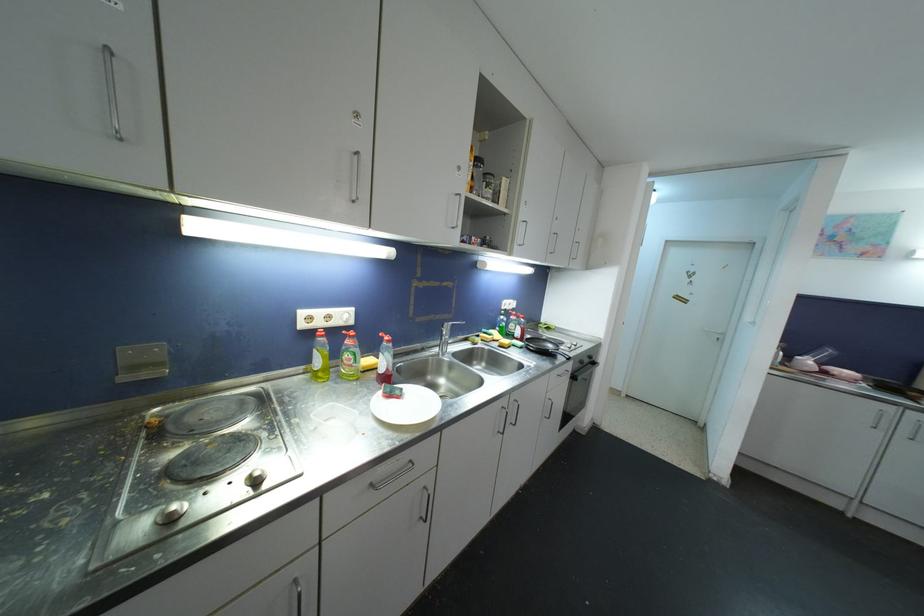
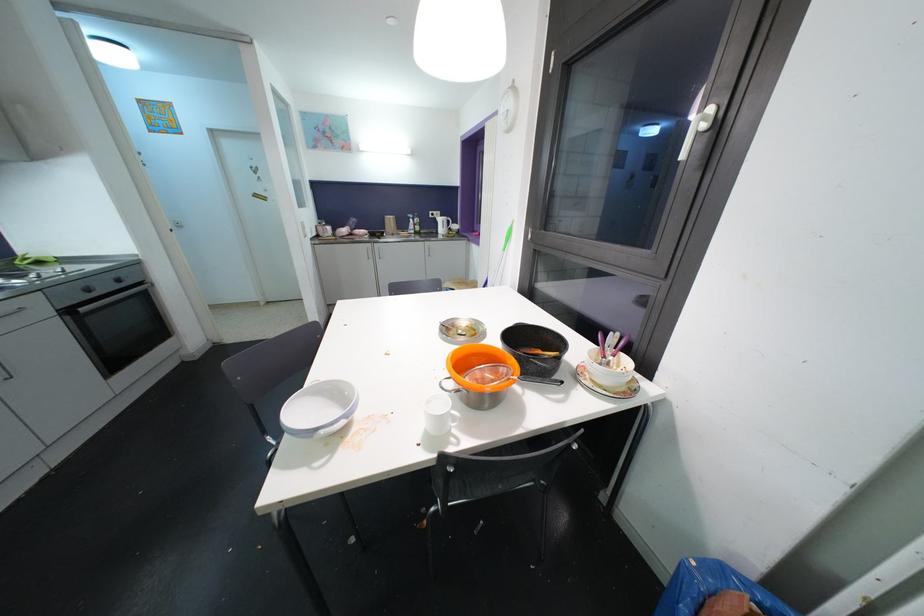
Where in the second image is the point corresponding to point (582, 381) from the first image?

(84, 312)